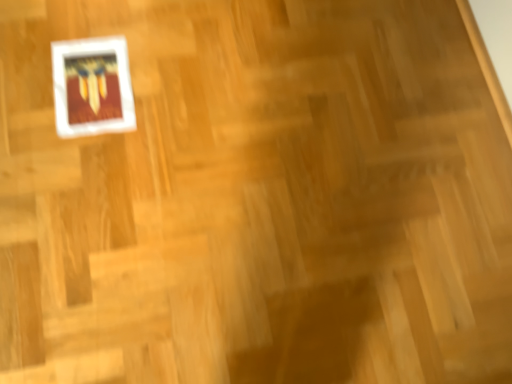
At what (x,y) coordinates should I click in order to perform the action: click on free location to the left of white glossy picture frame at upper left. Please return your answer as a coordinate pair (x, y). Looking at the image, I should click on (34, 57).